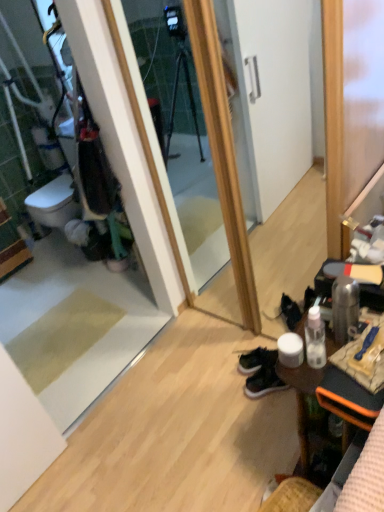
Find the location of a particular element. green suede sneakers at lower center, which appears as the first footwear when viewed from the front is located at coordinates (263, 382).

What do you see at coordinates (301, 400) in the screenshot? I see `wooden desk at lower right` at bounding box center [301, 400].

In order to face dark green suede sneakers at lower right, arranged as the first footwear when viewed from the back, should I rotate leftwards or rightwards?

To face it directly, rotate right by 9.782 degrees.

I want to click on green suede sneakers at lower center, marked as the second footwear in a back-to-front arrangement, so click(263, 382).

Is wooden desk at lower right far from green suede sneakers at lower center, marked as the second footwear in a back-to-front arrangement?

No, wooden desk at lower right is not far away from green suede sneakers at lower center, marked as the second footwear in a back-to-front arrangement.

Is green suede sneakers at lower center, marked as the second footwear in a back-to-front arrangement, completely or partially inside wooden desk at lower right?

No.

Considering the positions of points (305, 403) and (264, 385), is point (305, 403) closer to camera compared to point (264, 385)?

Yes, it is.

Locate an element on the screen. desk above the green suede sneakers at lower center, marked as the second footwear in a back-to-front arrangement (from the image's perspective) is located at coordinates (301, 400).

Can you tell me how much green suede sneakers at lower center, marked as the second footwear in a back-to-front arrangement, and dark green suede sneakers at lower right, arranged as the first footwear when viewed from the back, differ in facing direction?

The angle between the facing direction of green suede sneakers at lower center, marked as the second footwear in a back-to-front arrangement, and the facing direction of dark green suede sneakers at lower right, arranged as the first footwear when viewed from the back, is 3.99 degrees.

From the picture: Is the position of green suede sneakers at lower center, marked as the second footwear in a back-to-front arrangement, more distant than that of dark green suede sneakers at lower right, the 2th footwear viewed from the front?

Answer: No, green suede sneakers at lower center, marked as the second footwear in a back-to-front arrangement, is in front of dark green suede sneakers at lower right, the 2th footwear viewed from the front.

Is green suede sneakers at lower center, which appears as the first footwear when viewed from the front, spatially inside dark green suede sneakers at lower right, the 2th footwear viewed from the front, or outside of it?

The correct answer is: outside.

Would you say green suede sneakers at lower center, which appears as the first footwear when viewed from the front, is outside wooden desk at lower right?

Indeed, green suede sneakers at lower center, which appears as the first footwear when viewed from the front, is completely outside wooden desk at lower right.

Which of these two, green suede sneakers at lower center, which appears as the first footwear when viewed from the front, or wooden desk at lower right, stands shorter?

With less height is green suede sneakers at lower center, which appears as the first footwear when viewed from the front.

Is green suede sneakers at lower center, which appears as the first footwear when viewed from the front, far from wooden desk at lower right?

Actually, green suede sneakers at lower center, which appears as the first footwear when viewed from the front, and wooden desk at lower right are a little close together.

From a real-world perspective, is wooden desk at lower right physically located above or below dark green suede sneakers at lower right, the 2th footwear viewed from the front?

In terms of real-world spatial position, wooden desk at lower right is above dark green suede sneakers at lower right, the 2th footwear viewed from the front.

Are wooden desk at lower right and dark green suede sneakers at lower right, the 2th footwear viewed from the front, far apart?

wooden desk at lower right is near dark green suede sneakers at lower right, the 2th footwear viewed from the front, not far away.

Is dark green suede sneakers at lower right, arranged as the first footwear when viewed from the back, a part of wooden desk at lower right?

No, dark green suede sneakers at lower right, arranged as the first footwear when viewed from the back, is located outside of wooden desk at lower right.

The width and height of the screenshot is (384, 512). What are the coordinates of `the 2nd footwear directly beneath the wooden desk at lower right (from a real-world perspective)` in the screenshot? It's located at (256, 360).

From a real-world perspective, is dark green suede sneakers at lower right, the 2th footwear viewed from the front, positioned over wooden desk at lower right based on gravity?

No, from a real-world perspective, dark green suede sneakers at lower right, the 2th footwear viewed from the front, is not over wooden desk at lower right

Where is `desk lying in front of the dark green suede sneakers at lower right, arranged as the first footwear when viewed from the back`? Image resolution: width=384 pixels, height=512 pixels. desk lying in front of the dark green suede sneakers at lower right, arranged as the first footwear when viewed from the back is located at coordinates (301, 400).

Considering the positions of objects dark green suede sneakers at lower right, the 2th footwear viewed from the front, and wooden desk at lower right in the image provided, who is in front, dark green suede sneakers at lower right, the 2th footwear viewed from the front, or wooden desk at lower right?

wooden desk at lower right is in front.

Between dark green suede sneakers at lower right, the 2th footwear viewed from the front, and wooden desk at lower right, which one has smaller width?

Thinner between the two is dark green suede sneakers at lower right, the 2th footwear viewed from the front.

In the image, is dark green suede sneakers at lower right, the 2th footwear viewed from the front, positioned in front of or behind green suede sneakers at lower center, marked as the second footwear in a back-to-front arrangement?

Clearly, dark green suede sneakers at lower right, the 2th footwear viewed from the front, is behind green suede sneakers at lower center, marked as the second footwear in a back-to-front arrangement.

Between dark green suede sneakers at lower right, arranged as the first footwear when viewed from the back, and green suede sneakers at lower center, which appears as the first footwear when viewed from the front, which one has larger width?

dark green suede sneakers at lower right, arranged as the first footwear when viewed from the back, is wider.

This screenshot has height=512, width=384. I want to click on footwear lying below the dark green suede sneakers at lower right, arranged as the first footwear when viewed from the back (from the image's perspective), so click(263, 382).

Is dark green suede sneakers at lower right, the 2th footwear viewed from the front, turned away from green suede sneakers at lower center, marked as the second footwear in a back-to-front arrangement?

No, dark green suede sneakers at lower right, the 2th footwear viewed from the front, is not facing away from green suede sneakers at lower center, marked as the second footwear in a back-to-front arrangement.

The width and height of the screenshot is (384, 512). What are the coordinates of `desk to the right of green suede sneakers at lower center, which appears as the first footwear when viewed from the front` in the screenshot? It's located at (301, 400).

I want to click on footwear located above the green suede sneakers at lower center, which appears as the first footwear when viewed from the front (from the image's perspective), so click(256, 360).

When comparing their distances from green suede sneakers at lower center, marked as the second footwear in a back-to-front arrangement, does wooden desk at lower right or dark green suede sneakers at lower right, arranged as the first footwear when viewed from the back, seem further?

wooden desk at lower right is positioned further to the anchor green suede sneakers at lower center, marked as the second footwear in a back-to-front arrangement.

From the image, which object appears to be farther from dark green suede sneakers at lower right, the 2th footwear viewed from the front, green suede sneakers at lower center, marked as the second footwear in a back-to-front arrangement, or wooden desk at lower right?

Based on the image, wooden desk at lower right appears to be further to dark green suede sneakers at lower right, the 2th footwear viewed from the front.

Estimate the real-world distances between objects in this image. Which object is further from wooden desk at lower right, dark green suede sneakers at lower right, the 2th footwear viewed from the front, or green suede sneakers at lower center, marked as the second footwear in a back-to-front arrangement?

dark green suede sneakers at lower right, the 2th footwear viewed from the front.

Based on their spatial positions, is green suede sneakers at lower center, which appears as the first footwear when viewed from the front, or dark green suede sneakers at lower right, arranged as the first footwear when viewed from the back, closer to wooden desk at lower right?

green suede sneakers at lower center, which appears as the first footwear when viewed from the front, is closer to wooden desk at lower right.

In the scene shown: Which object lies further to the anchor point green suede sneakers at lower center, marked as the second footwear in a back-to-front arrangement, dark green suede sneakers at lower right, the 2th footwear viewed from the front, or wooden desk at lower right?

wooden desk at lower right.

Looking at the image, which one is located further to dark green suede sneakers at lower right, arranged as the first footwear when viewed from the back, wooden desk at lower right or green suede sneakers at lower center, marked as the second footwear in a back-to-front arrangement?

Among the two, wooden desk at lower right is located further to dark green suede sneakers at lower right, arranged as the first footwear when viewed from the back.

The width and height of the screenshot is (384, 512). I want to click on footwear between wooden desk at lower right and dark green suede sneakers at lower right, arranged as the first footwear when viewed from the back, in the front-back direction, so pos(263,382).